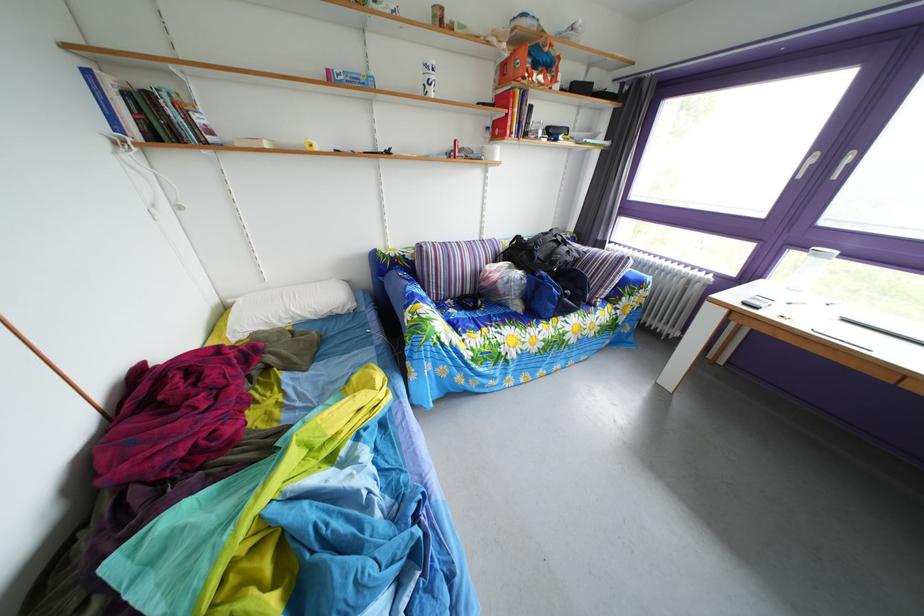
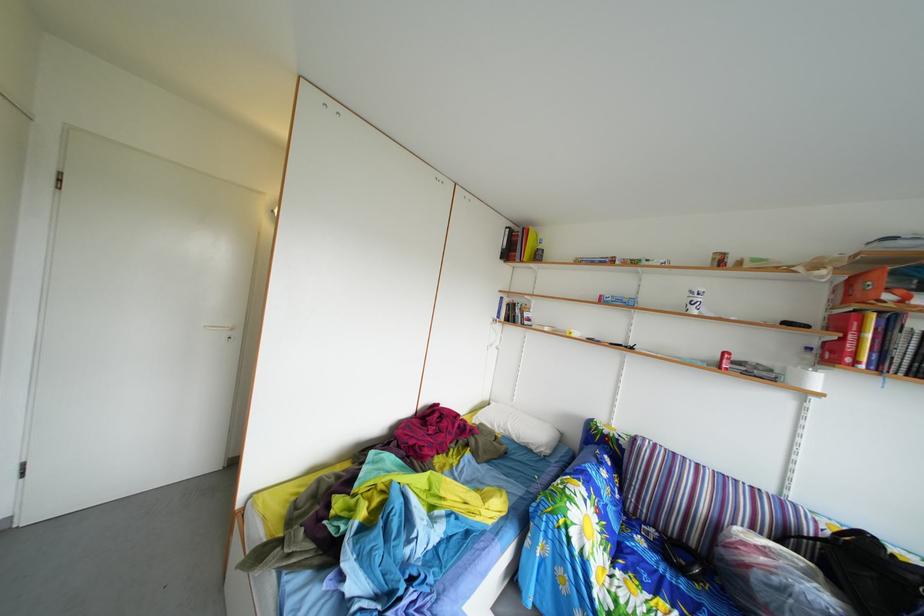
Question: The first image is from the beginning of the video and the second image is from the end. How did the camera likely rotate when shooting the video?

Choices:
 (A) Left
 (B) Right
 (C) Up
 (D) Down

Answer: (A)